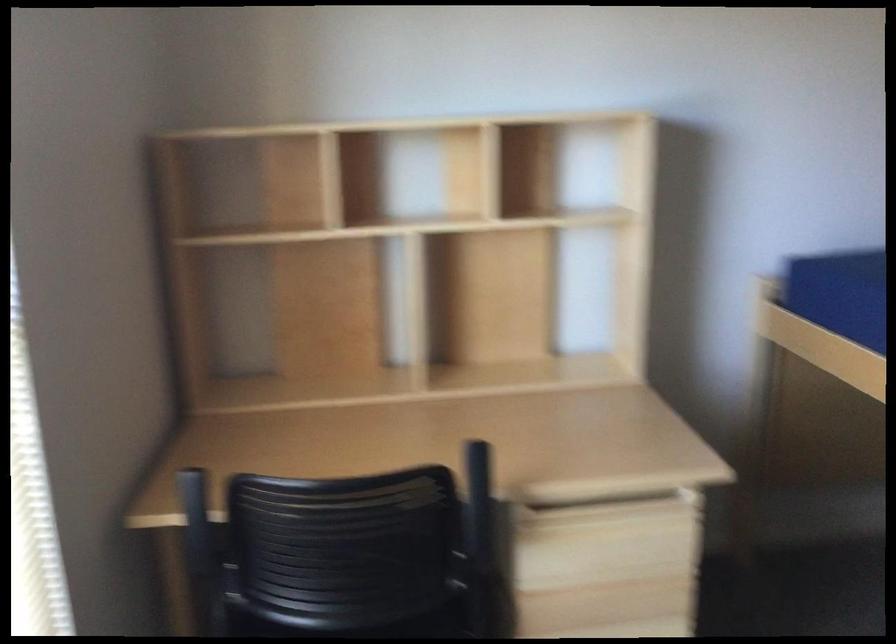
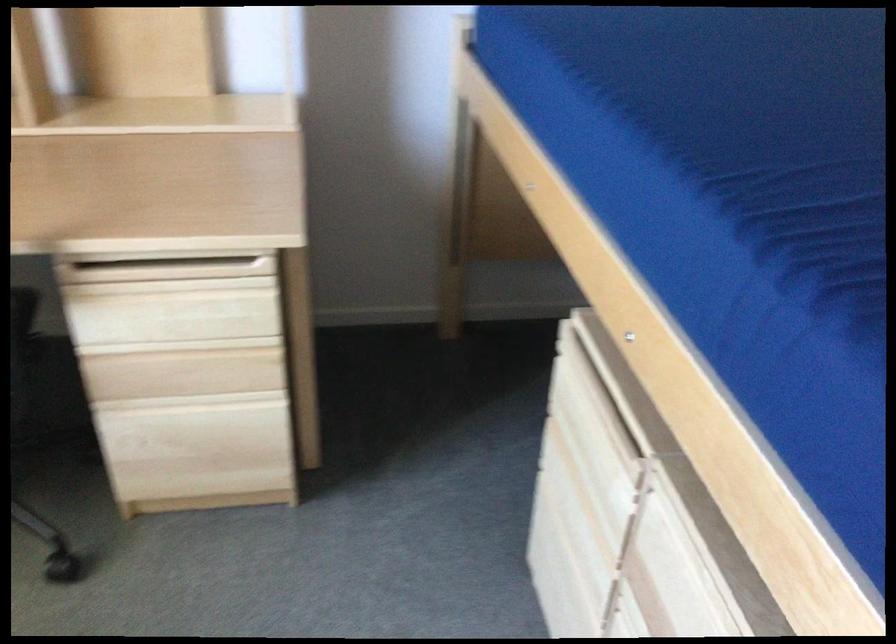
Question: The images are taken continuously from a first-person perspective. In which direction are you moving?

Choices:
 (A) Left
 (B) Right
 (C) Forward
 (D) Backward

Answer: (B)